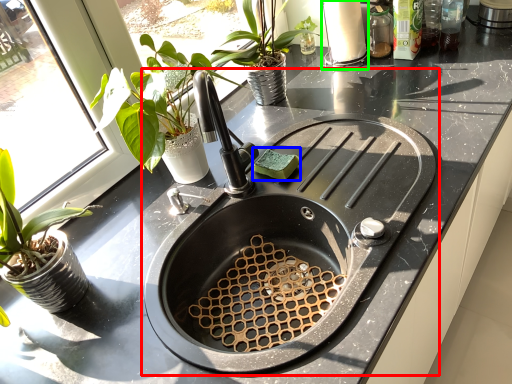
Question: Based on their relative distances, which object is nearer to sink (highlighted by a red box)? Choose from food (highlighted by a blue box) and appliance (highlighted by a green box).

Choices:
 (A) food
 (B) appliance

Answer: (A)